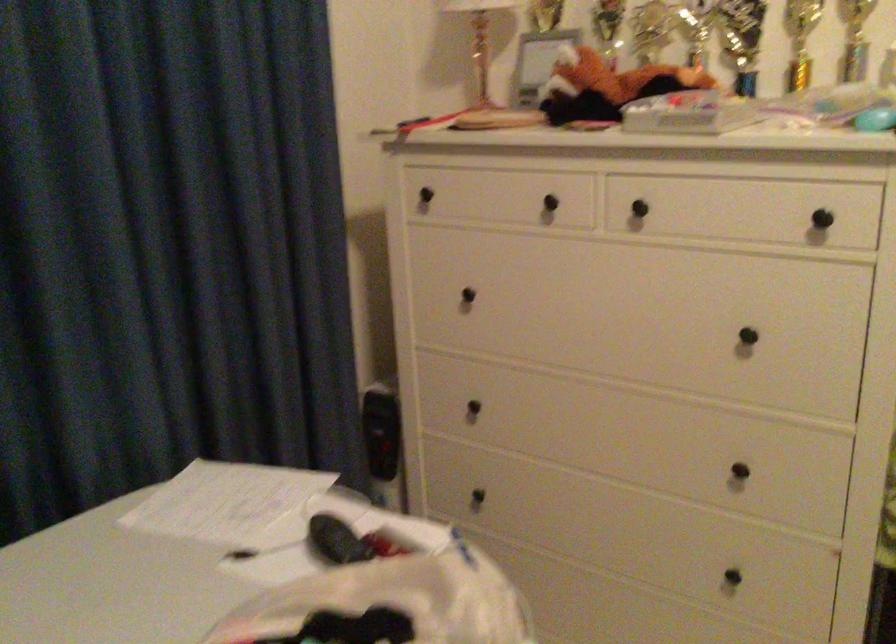
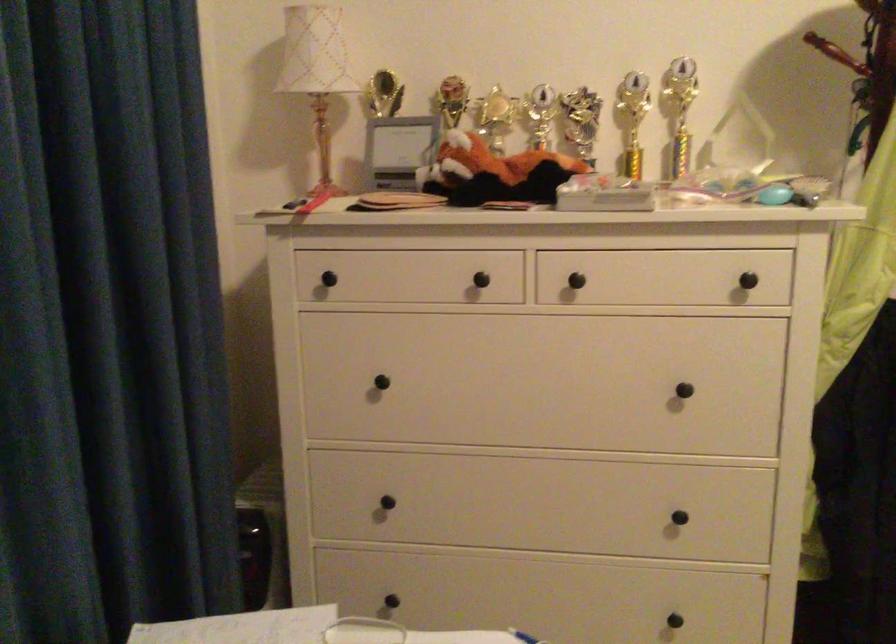
Question: Based on the continuous images, in which direction is the camera rotating? Reply with the corresponding letter.

Choices:
 (A) Left
 (B) Right
 (C) Up
 (D) Down

Answer: (B)